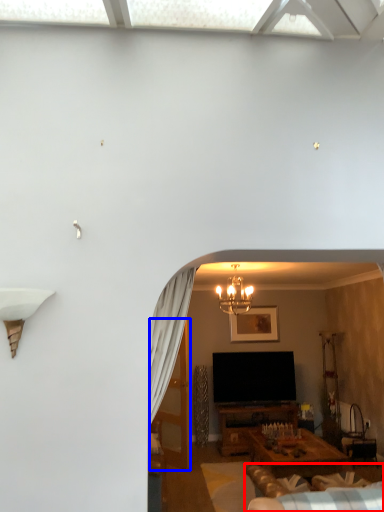
Question: Which of the following is the closest to the observer, couch (highlighted by a red box) or glass door (highlighted by a blue box)?

Choices:
 (A) couch
 (B) glass door

Answer: (A)